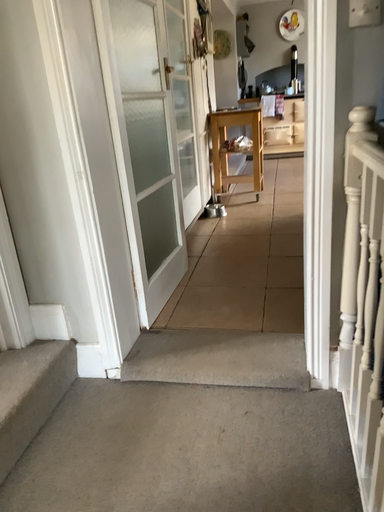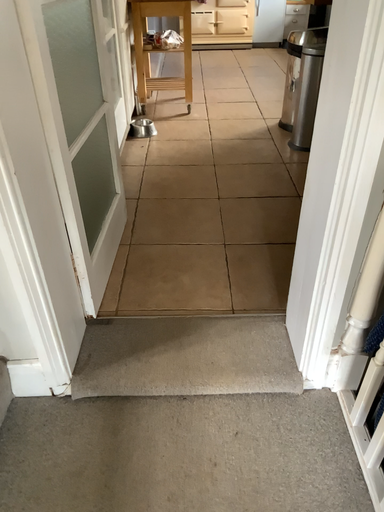
Question: How did the camera likely rotate when shooting the video?

Choices:
 (A) rotated downward
 (B) rotated upward

Answer: (A)